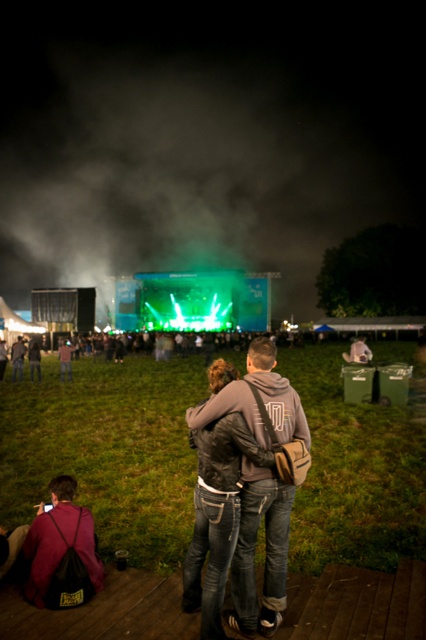
How far apart are maroon fabric jacket at lower left and dark gray hoodie at center?

maroon fabric jacket at lower left is 18.69 meters from dark gray hoodie at center.

Who is positioned more to the right, maroon fabric jacket at lower left or dark gray hoodie at center?

maroon fabric jacket at lower left is more to the right.

Where is `maroon fabric jacket at lower left`? This screenshot has height=640, width=426. maroon fabric jacket at lower left is located at coordinates (62, 552).

Is denim jacket at center further to the viewer compared to dark gray hoodie at center?

No, it is in front of dark gray hoodie at center.

Is denim jacket at center shorter than dark gray hoodie at center?

No.

Locate an element on the screen. The width and height of the screenshot is (426, 640). denim jacket at center is located at coordinates (265, 548).

Which is more to the left, denim jacket at center or maroon fabric jacket at lower left?

From the viewer's perspective, maroon fabric jacket at lower left appears more on the left side.

Can you confirm if denim jacket at center is positioned below maroon fabric jacket at lower left?

Incorrect, denim jacket at center is not positioned below maroon fabric jacket at lower left.

The height and width of the screenshot is (640, 426). Describe the element at coordinates (265, 548) in the screenshot. I see `denim jacket at center` at that location.

What are the coordinates of `denim jacket at center` in the screenshot? It's located at (265, 548).